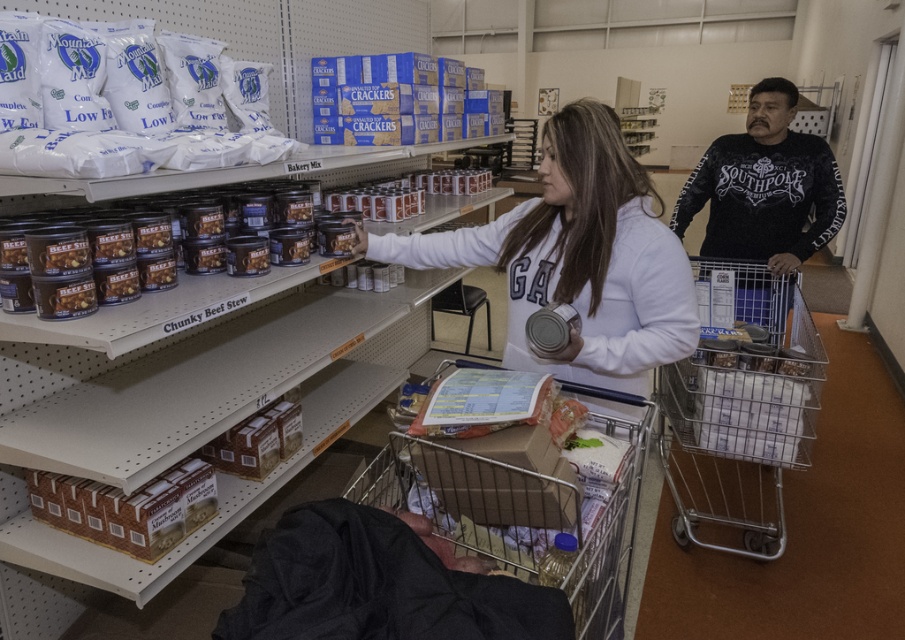
You are standing in the pantry and need to decide which item to move first. Based on their sizes, which item should you pick up first, the white matte sweatshirt at center or the metallic silver shopping cart at lower center?

The white matte sweatshirt at center has a smaller size compared to the metallic silver shopping cart at lower center, so you should pick up the white matte sweatshirt at center first since it is smaller and easier to handle.

What is the 2D coordinate of the metallic silver shopping cart at lower center?

The metallic silver shopping cart at lower center is located at the 2D coordinate point of [525,508].